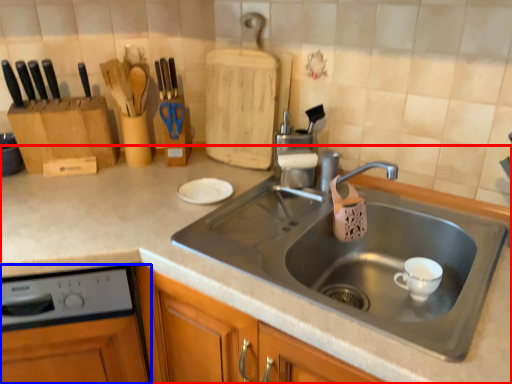
Question: Among these objects, which one is farthest to the camera, countertop (highlighted by a red box) or dish washer (highlighted by a blue box)?

Choices:
 (A) countertop
 (B) dish washer

Answer: (B)